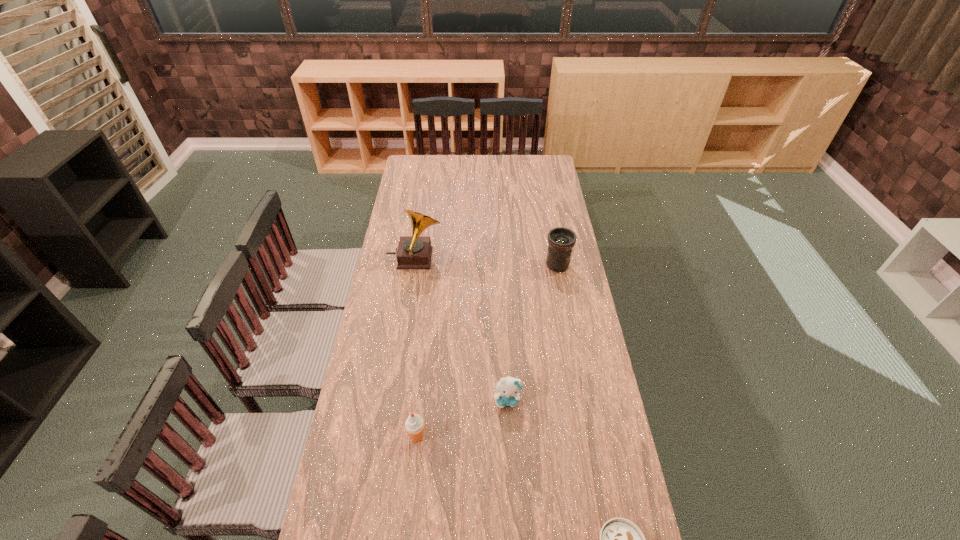
At what (x,y) coordinates should I click in order to perform the action: click on unoccupied area between the second nearest object and the telephoto lens. Please return your answer as a coordinate pair (x, y). The width and height of the screenshot is (960, 540). Looking at the image, I should click on (487, 350).

Find the location of `unoccupied position between the phonograph record and the kitten`. unoccupied position between the phonograph record and the kitten is located at coordinates (461, 329).

This screenshot has height=540, width=960. In order to click on free space between the kitten and the icecream in this screenshot , I will do (x=462, y=418).

At what (x,y) coordinates should I click in order to perform the action: click on object that ranks as the closest to the third shortest object. Please return your answer as a coordinate pair (x, y). Looking at the image, I should click on (509, 388).

This screenshot has height=540, width=960. Find the location of `object identified as the closest to the icecream`. object identified as the closest to the icecream is located at coordinates (509, 388).

Find the location of a particular element. free space that satisfies the following two spatial constraints: 1. from the horn of the phonograph record; 2. on the back side of the telephoto lens is located at coordinates (414, 265).

At what (x,y) coordinates should I click in order to perform the action: click on free space that satisfies the following two spatial constraints: 1. on the back side of the telephoto lens; 2. on the left side of the fourth farthest object. Please return your answer as a coordinate pair (x, y). This screenshot has height=540, width=960. Looking at the image, I should click on (435, 265).

At what (x,y) coordinates should I click in order to perform the action: click on vacant region that satisfies the following two spatial constraints: 1. from the horn of the second nearest object; 2. on the right side of the tallest object. Please return your answer as a coordinate pair (x, y). Image resolution: width=960 pixels, height=540 pixels. Looking at the image, I should click on (388, 436).

Find the location of a particular element. The image size is (960, 540). vacant position in the image that satisfies the following two spatial constraints: 1. from the horn of the icecream; 2. on the left side of the tallest object is located at coordinates (388, 436).

This screenshot has width=960, height=540. Identify the location of free region that satisfies the following two spatial constraints: 1. from the horn of the tallest object; 2. on the back side of the telephoto lens. (414, 265).